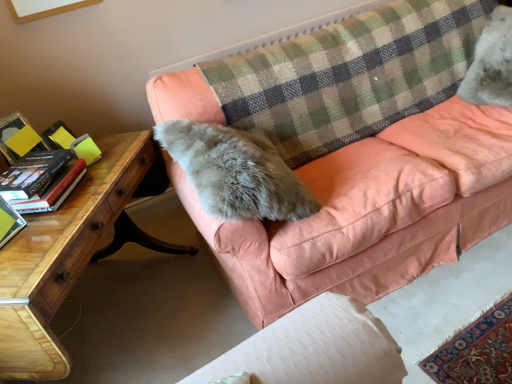
Find the location of a particular element. This screenshot has height=384, width=512. free space to the right of hardcover book at left, the first paperback book viewed from the back is located at coordinates (99, 181).